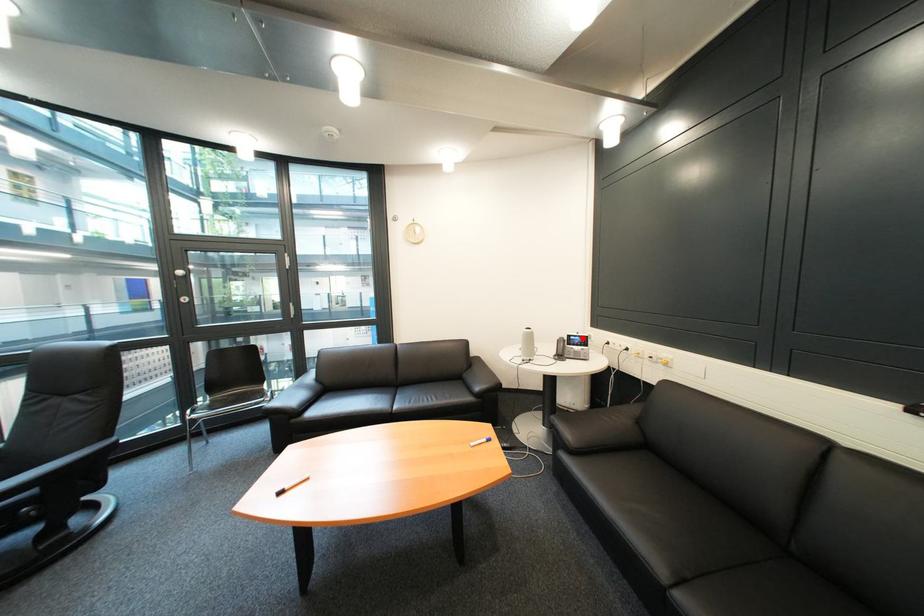
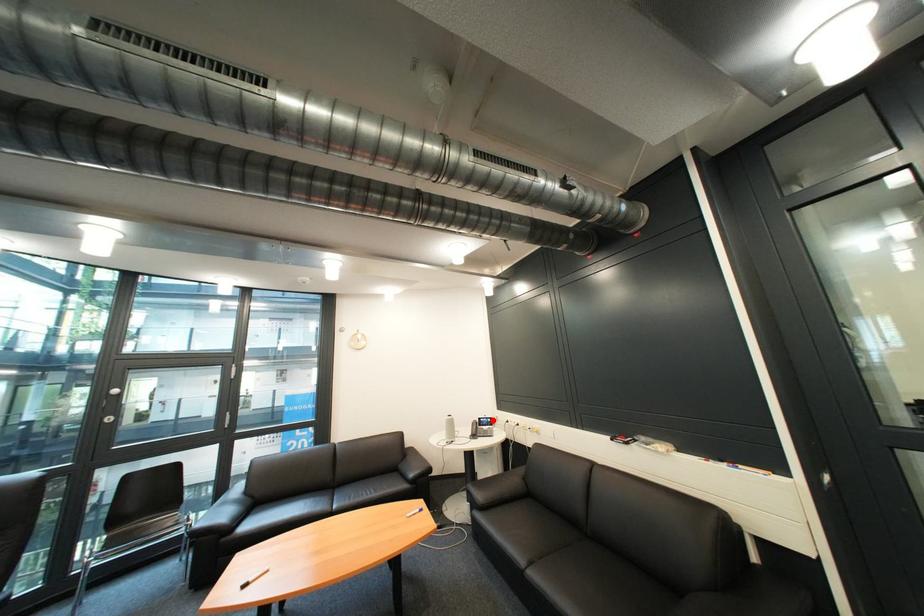
I am providing you with two images of the same scene from different viewpoints. A red point is marked on the first image and another point is marked on the second image. Do the highlighted points in image1 and image2 indicate the same real-world spot?

Yes